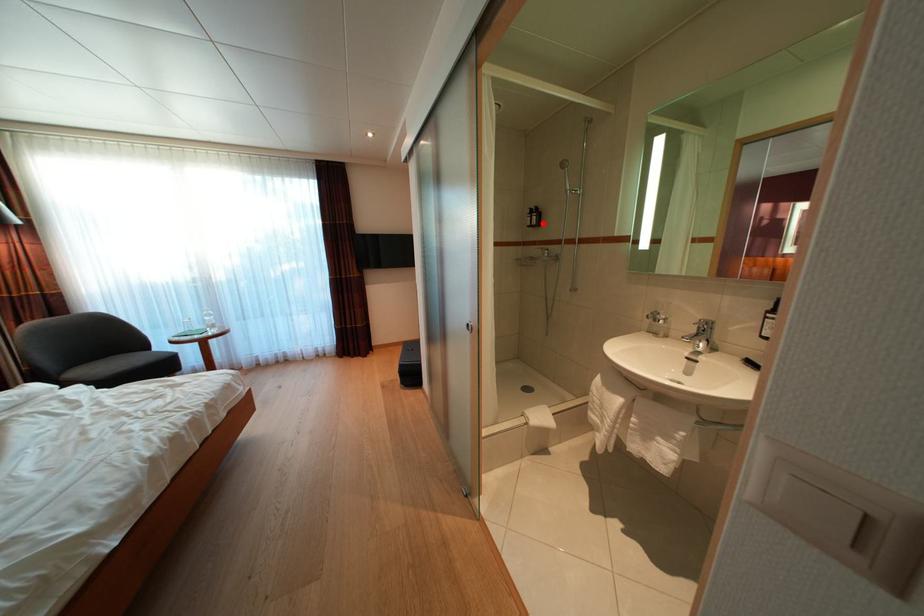
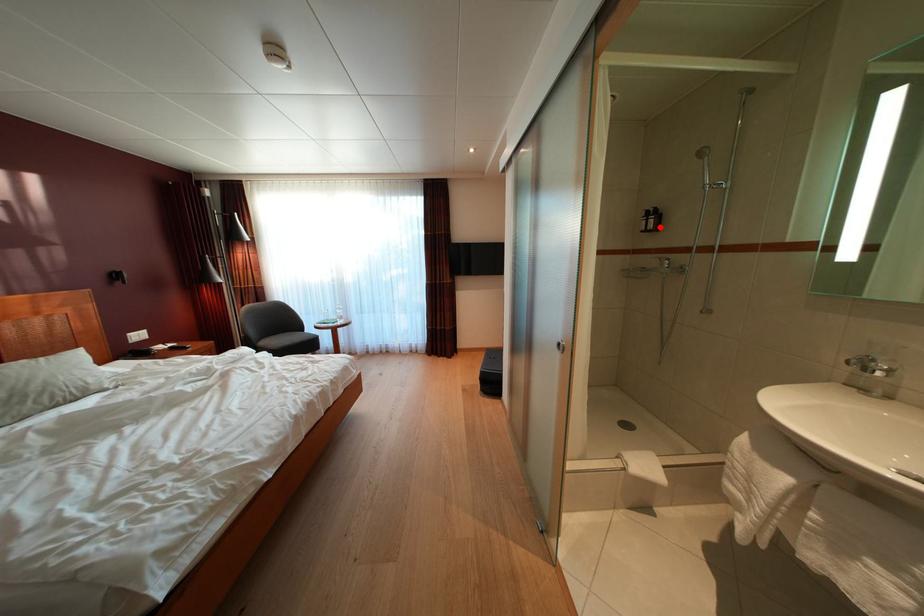
I am providing you with two images of the same scene from different viewpoints. A red point is marked on the first image and another point is marked on the second image. Is the red point in image1 aligned with the point shown in image2?

Yes